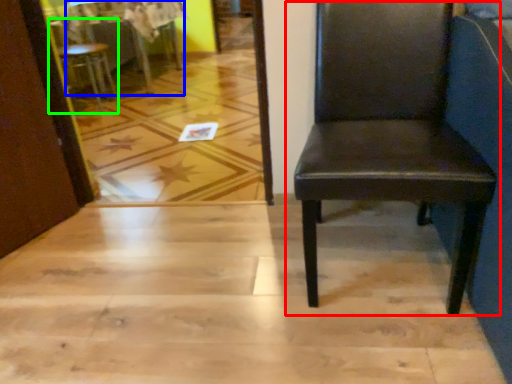
Question: Based on their relative distances, which object is farther from chair (highlighted by a red box)? Choose from table (highlighted by a blue box) and chair (highlighted by a green box).

Choices:
 (A) table
 (B) chair

Answer: (A)